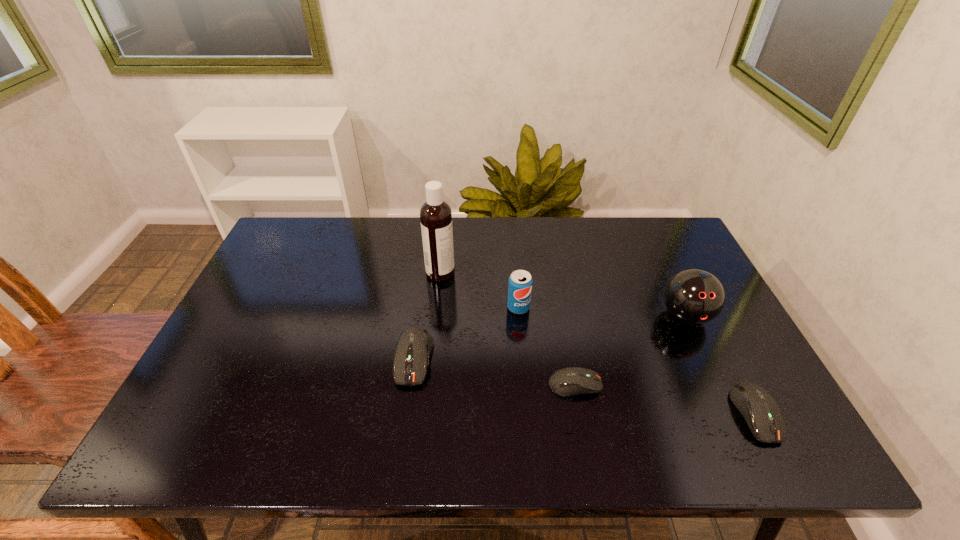
Locate an element on the screen. The width and height of the screenshot is (960, 540). vacant area that satisfies the following two spatial constraints: 1. on the back side of the third object from left to right; 2. on the label side of the farthest object is located at coordinates (516, 273).

The width and height of the screenshot is (960, 540). Identify the location of vacant space that satisfies the following two spatial constraints: 1. on the surface of the second tallest object near the finger holes; 2. on the button of the third object from right to left. (717, 384).

Image resolution: width=960 pixels, height=540 pixels. In order to click on free location that satisfies the following two spatial constraints: 1. on the surface of the fifth shortest object near the finger holes; 2. on the button of the shortest computer equipment in this screenshot , I will do pyautogui.click(x=717, y=384).